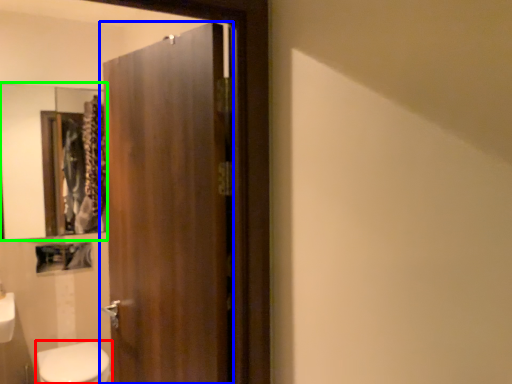
Question: Which object is the closest to the bidet (highlighted by a red box)? Choose among these: door (highlighted by a blue box) or mirror (highlighted by a green box).

Choices:
 (A) door
 (B) mirror

Answer: (A)